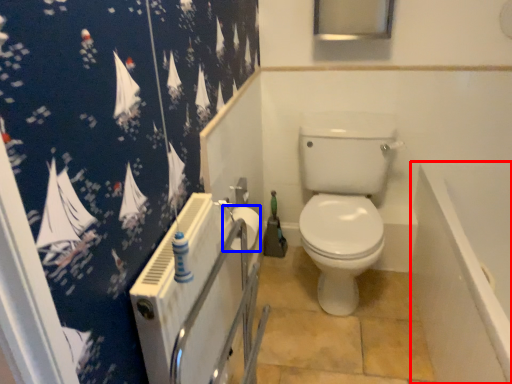
Question: Which object is closer to the camera taking this photo, bath (highlighted by a red box) or toilet paper (highlighted by a blue box)?

Choices:
 (A) bath
 (B) toilet paper

Answer: (A)